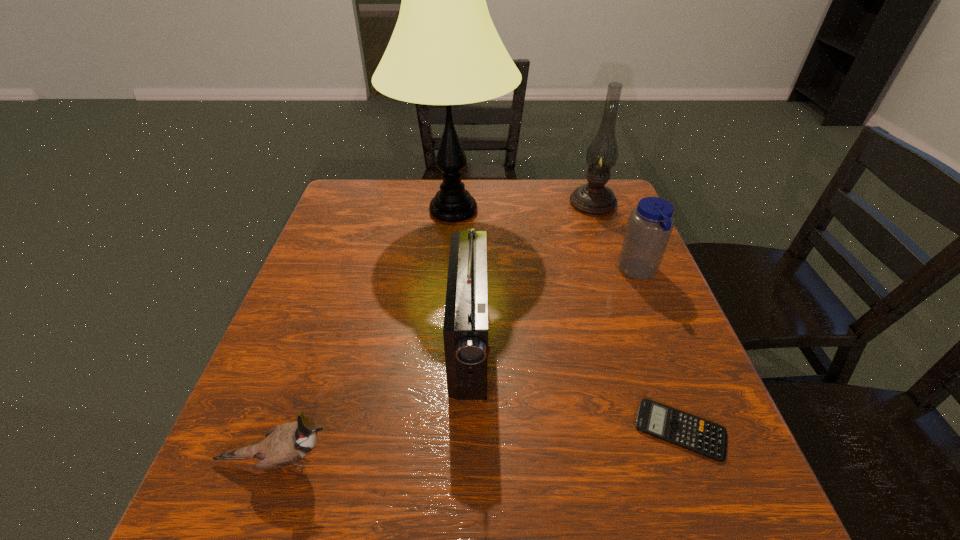
This screenshot has width=960, height=540. Identify the location of free location located 0.390m with a carrying loop on the side of the third farthest object. (456, 272).

Find the location of `vacant space located with a carrying loop on the side of the third farthest object`. vacant space located with a carrying loop on the side of the third farthest object is located at coordinates (481, 272).

The width and height of the screenshot is (960, 540). I want to click on vacant region located with a carrying loop on the side of the third farthest object, so click(577, 272).

Where is `free space located at the face of the second shortest object`? free space located at the face of the second shortest object is located at coordinates (569, 461).

Where is `free spot located 0.390m on the left of the calculator`? free spot located 0.390m on the left of the calculator is located at coordinates (408, 430).

Where is `lamp located in the far edge section of the desktop`? This screenshot has height=540, width=960. lamp located in the far edge section of the desktop is located at coordinates (445, 50).

The image size is (960, 540). In order to click on oil lamp located at the far edge in this screenshot , I will do `click(594, 198)`.

Locate an element on the screen. The width and height of the screenshot is (960, 540). object located at the near edge is located at coordinates (285, 444).

You are a GUI agent. You are given a task and a screenshot of the screen. Output one action in this format:
    pyautogui.click(x=<x>, y=<y>)
    Task: Click on the object situated at the left edge
    
    Given the screenshot: What is the action you would take?
    pyautogui.click(x=285, y=444)

Where is `oil lamp positioned at the right edge`? The image size is (960, 540). oil lamp positioned at the right edge is located at coordinates (594, 198).